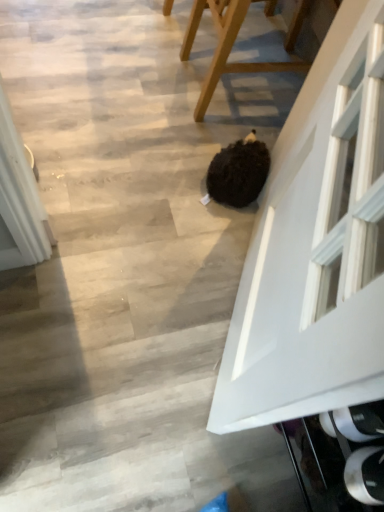
Question: Is white glossy door at center touching wooden chair at center?

Choices:
 (A) yes
 (B) no

Answer: (B)

Question: Can you confirm if white glossy door at center is thinner than wooden chair at center?

Choices:
 (A) no
 (B) yes

Answer: (B)

Question: From a real-world perspective, is white glossy door at center on wooden chair at center?

Choices:
 (A) no
 (B) yes

Answer: (B)

Question: Is white glossy door at center shorter than wooden chair at center?

Choices:
 (A) no
 (B) yes

Answer: (A)

Question: Is white glossy door at center located outside wooden chair at center?

Choices:
 (A) no
 (B) yes

Answer: (B)

Question: From a real-world perspective, is white glossy door at center located beneath wooden chair at center?

Choices:
 (A) yes
 (B) no

Answer: (B)

Question: From the image's perspective, is wooden chair at center located above white glossy door at center?

Choices:
 (A) yes
 (B) no

Answer: (A)

Question: Does wooden chair at center have a lesser width compared to white glossy door at center?

Choices:
 (A) no
 (B) yes

Answer: (A)

Question: Is wooden chair at center closer to camera compared to white glossy door at center?

Choices:
 (A) yes
 (B) no

Answer: (B)

Question: Is white glossy door at center at the back of wooden chair at center?

Choices:
 (A) yes
 (B) no

Answer: (B)

Question: Does wooden chair at center appear on the right side of white glossy door at center?

Choices:
 (A) yes
 (B) no

Answer: (A)

Question: From a real-world perspective, is wooden chair at center positioned over white glossy door at center based on gravity?

Choices:
 (A) no
 (B) yes

Answer: (A)

Question: Based on their positions, is white glossy door at center located to the left or right of wooden chair at center?

Choices:
 (A) right
 (B) left

Answer: (B)